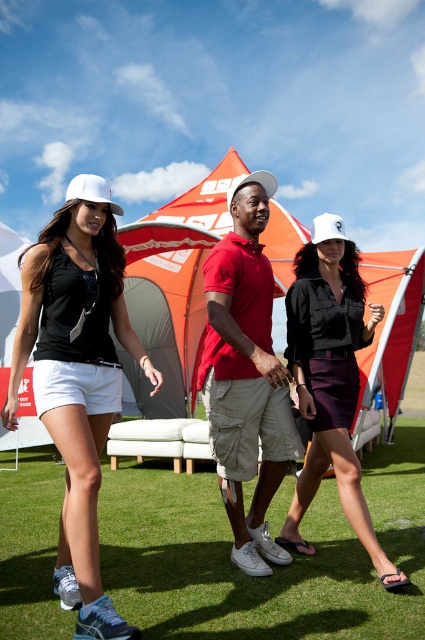
Question: Does matte black skirt at center have a greater width compared to white matte baseball cap at left?

Choices:
 (A) yes
 (B) no

Answer: (B)

Question: Which point appears closest to the camera in this image?

Choices:
 (A) (x=249, y=173)
 (B) (x=323, y=221)
 (C) (x=65, y=196)

Answer: (A)

Question: Which point is closer to the camera taking this photo?

Choices:
 (A) (241, 179)
 (B) (359, 336)
 (C) (108, 196)
 (D) (240, 380)

Answer: (C)

Question: Can you confirm if matte black tank top at center is wider than white matte baseball cap at left?

Choices:
 (A) yes
 (B) no

Answer: (B)

Question: Is matte black skirt at center positioned at the back of white matte baseball cap at center?

Choices:
 (A) yes
 (B) no

Answer: (B)

Question: Which object is positioned farthest from the white matte baseball cap at left?

Choices:
 (A) matte black tank top at center
 (B) white matte baseball cap at center

Answer: (B)